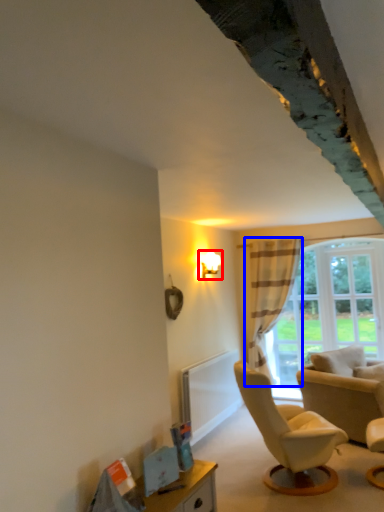
Question: Which object is further to the camera taking this photo, light fixture (highlighted by a red box) or curtain (highlighted by a blue box)?

Choices:
 (A) light fixture
 (B) curtain

Answer: (B)